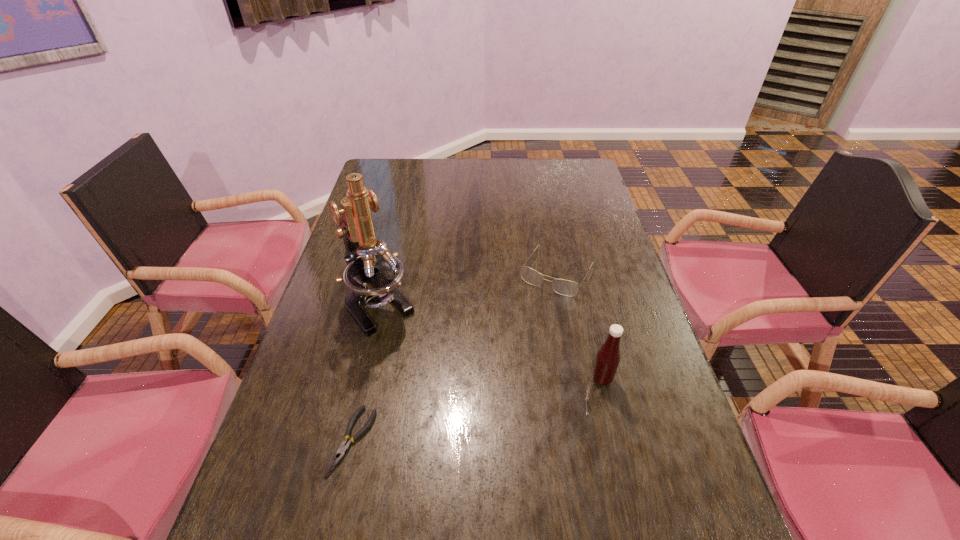
You are a GUI agent. You are given a task and a screenshot of the screen. Output one action in this format:
    pyautogui.click(x=<x>, y=<y>)
    Task: Click on the vacant space on the desktop that is between the shortest object and the third farthest object and is positioned on the front-facing side of the second shortest object
    
    Given the screenshot: What is the action you would take?
    pyautogui.click(x=477, y=410)

This screenshot has height=540, width=960. I want to click on free spot on the desktop that is between the nearest object and the Tabasco sauce and is positioned at the eyepiece of the microscope, so click(468, 413).